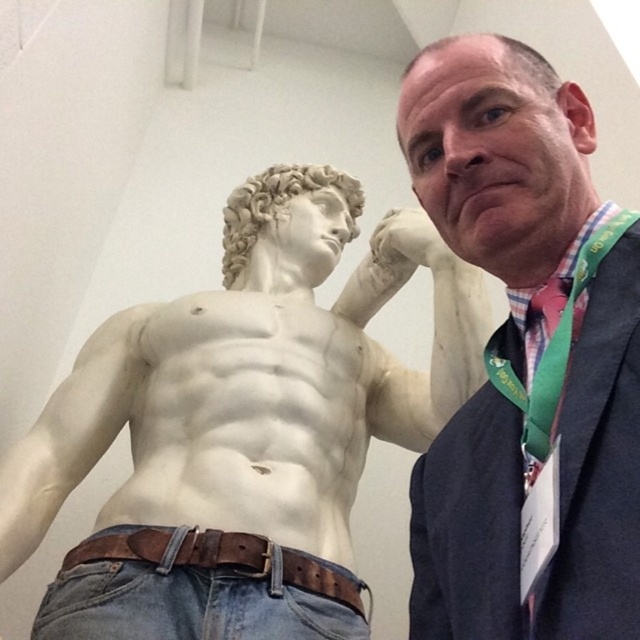
You are an art curator planning to move the brown leather belt at lower center to a different exhibit. To do this, you need to know if the white marble statue at center is blocking the belt. Is the statue blocking the belt?

The white marble statue at center is in front of the brown leather belt at lower center, so yes, the statue is blocking the belt.

You are standing in a gallery where the white marble statue at center is displayed. If you want to take a photo of the statue from the front, where should you position yourself relative to the statue?

Since the white marble statue at center is positioned at point [246,413], you should stand directly in front of it to capture the front view. The coordinates indicate its central placement, so positioning yourself opposite the statue along its central axis would ensure the best frontal shot.